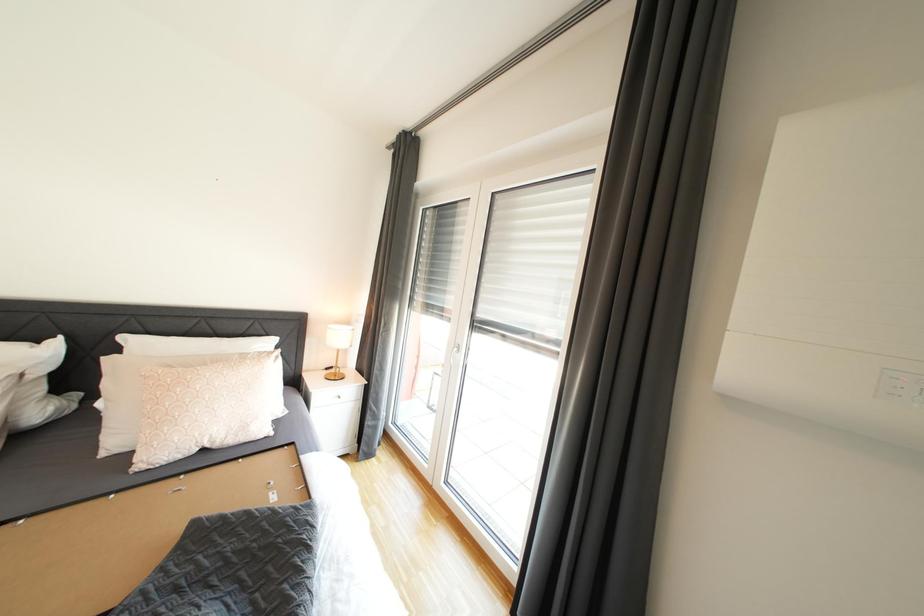
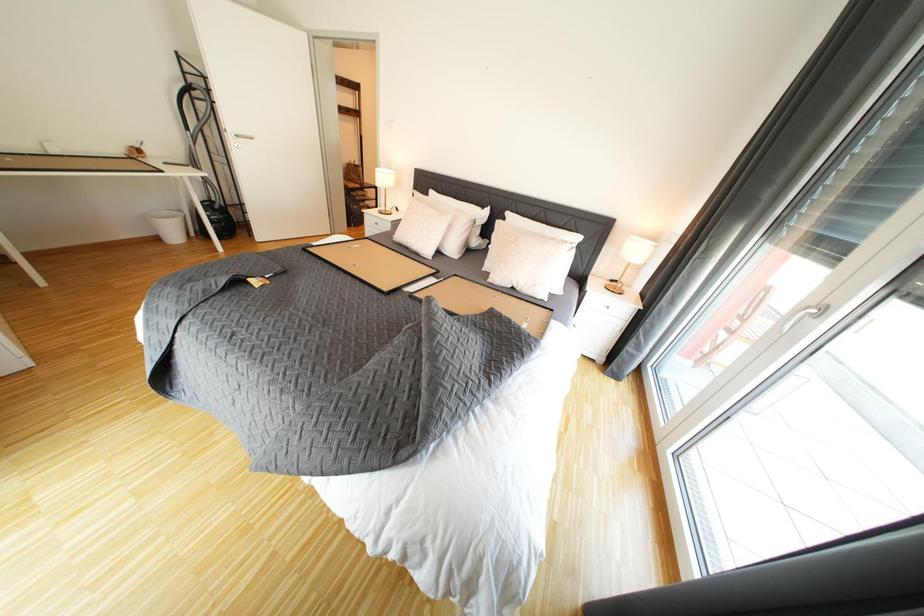
Based on the continuous images, in which direction is the camera rotating?

The camera rotated toward left-down.